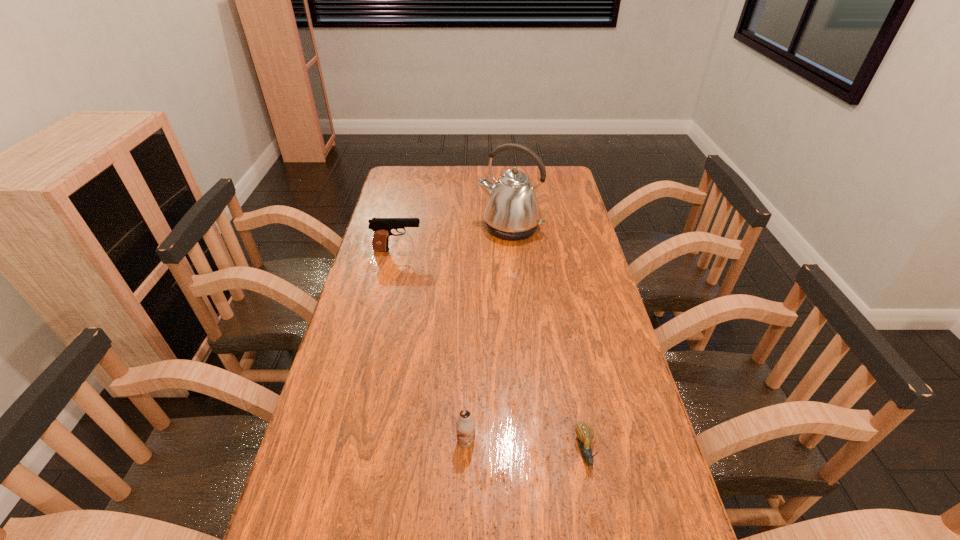
This screenshot has width=960, height=540. In order to click on object that is at the left edge in this screenshot , I will do `click(382, 227)`.

This screenshot has width=960, height=540. Identify the location of kettle that is at the right edge. (512, 212).

At what (x,y) coordinates should I click in order to perform the action: click on escargot that is at the right edge. Please return your answer as a coordinate pair (x, y). The image size is (960, 540). Looking at the image, I should click on (585, 433).

Locate an element on the screen. This screenshot has width=960, height=540. free spot at the far edge of the desktop is located at coordinates (500, 169).

In the image, there is a desktop. At what (x,y) coordinates should I click in order to perform the action: click on free space at the left edge. Please return your answer as a coordinate pair (x, y). This screenshot has width=960, height=540. Looking at the image, I should click on (404, 204).

In order to click on vacant space at the right edge in this screenshot , I will do `click(578, 239)`.

Find the location of a particular element. free spot at the far left corner of the desktop is located at coordinates (391, 172).

Where is `free spot between the pistol and the farthest object`? Image resolution: width=960 pixels, height=540 pixels. free spot between the pistol and the farthest object is located at coordinates point(454,239).

Identify the location of free point between the chocolate milk and the tallest object. (489, 335).

I want to click on unoccupied position between the second farthest object and the shortest object, so click(492, 350).